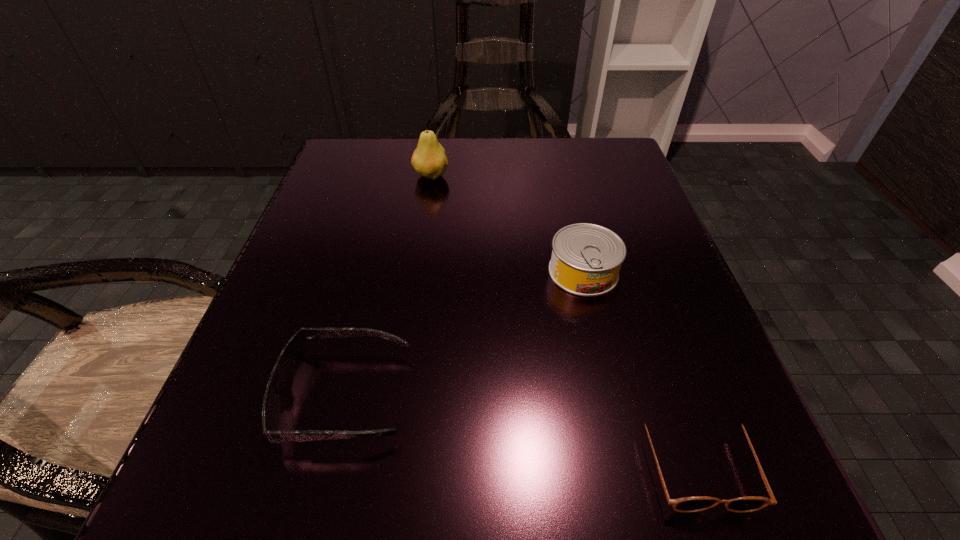
The width and height of the screenshot is (960, 540). I want to click on free point between the shorter sunglasses and the pear, so click(564, 318).

Identify which object is located as the nearest to the left sunglasses. Please provide its 2D coordinates. Your answer should be formatted as a tuple, i.e. [(x, y)], where the tuple contains the x and y coordinates of a point satisfying the conditions above.

[(586, 258)]

The image size is (960, 540). I want to click on object that is the third closest to the taller sunglasses, so click(429, 160).

Find the location of a particular element. blank area in the image that satisfies the following two spatial constraints: 1. on the front side of the third nearest object; 2. on the right side of the pear is located at coordinates (418, 272).

Where is `free location that satisfies the following two spatial constraints: 1. on the front side of the pear; 2. on the front-facing side of the left sunglasses`? The width and height of the screenshot is (960, 540). free location that satisfies the following two spatial constraints: 1. on the front side of the pear; 2. on the front-facing side of the left sunglasses is located at coordinates (399, 396).